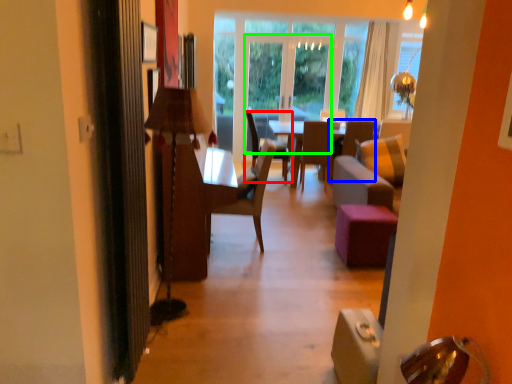
Question: Based on their relative distances, which object is farther from chair (highlighted by a red box)? Choose from armchair (highlighted by a blue box) and glass door (highlighted by a green box).

Choices:
 (A) armchair
 (B) glass door

Answer: (A)